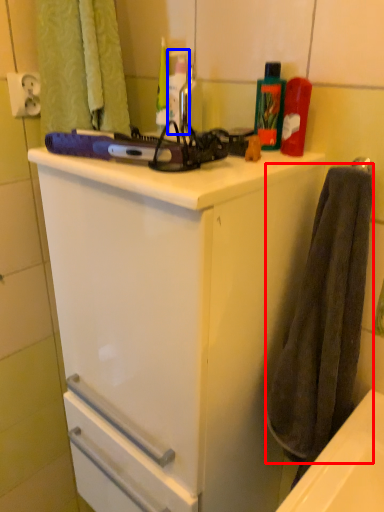
Question: Which object appears farthest to the camera in this image, bath towel (highlighted by a red box) or bottle (highlighted by a blue box)?

Choices:
 (A) bath towel
 (B) bottle

Answer: (B)